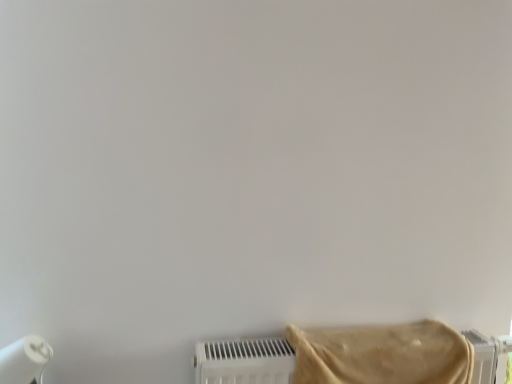
Question: Should I look upward or downward to see beige fabric towel at lower right?

Choices:
 (A) up
 (B) down

Answer: (B)

Question: Can you confirm if beige fabric towel at lower right is taller than white matte paper towel at lower left?

Choices:
 (A) no
 (B) yes

Answer: (A)

Question: Does beige fabric towel at lower right appear on the left side of white matte paper towel at lower left?

Choices:
 (A) no
 (B) yes

Answer: (A)

Question: From the image's perspective, is beige fabric towel at lower right beneath white matte paper towel at lower left?

Choices:
 (A) no
 (B) yes

Answer: (A)

Question: Is beige fabric towel at lower right not within white matte paper towel at lower left?

Choices:
 (A) no
 (B) yes

Answer: (B)

Question: Can you confirm if beige fabric towel at lower right is bigger than white matte paper towel at lower left?

Choices:
 (A) yes
 (B) no

Answer: (A)

Question: Is the depth of beige fabric towel at lower right less than that of white matte paper towel at lower left?

Choices:
 (A) no
 (B) yes

Answer: (B)

Question: From a real-world perspective, does white matte paper towel at lower left sit lower than beige fabric towel at lower right?

Choices:
 (A) yes
 (B) no

Answer: (A)

Question: Does white matte paper towel at lower left have a smaller size compared to beige fabric towel at lower right?

Choices:
 (A) yes
 (B) no

Answer: (A)

Question: Is the position of white matte paper towel at lower left less distant than that of beige fabric towel at lower right?

Choices:
 (A) yes
 (B) no

Answer: (B)

Question: Is white matte paper towel at lower left not within beige fabric towel at lower right?

Choices:
 (A) yes
 (B) no

Answer: (A)

Question: Considering the relative sizes of white matte paper towel at lower left and beige fabric towel at lower right in the image provided, is white matte paper towel at lower left thinner than beige fabric towel at lower right?

Choices:
 (A) no
 (B) yes

Answer: (B)

Question: Is white matte paper towel at lower left at the left side of beige fabric towel at lower right?

Choices:
 (A) yes
 (B) no

Answer: (A)

Question: Looking at the image, does white matte paper towel at lower left seem bigger or smaller compared to beige fabric towel at lower right?

Choices:
 (A) big
 (B) small

Answer: (B)